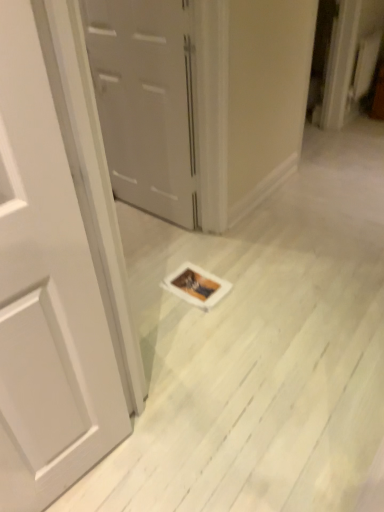
The height and width of the screenshot is (512, 384). I want to click on white matte door at center, so click(146, 102).

Image resolution: width=384 pixels, height=512 pixels. Describe the element at coordinates (146, 102) in the screenshot. I see `white matte door at center` at that location.

The height and width of the screenshot is (512, 384). I want to click on white matte door at center, so click(x=146, y=102).